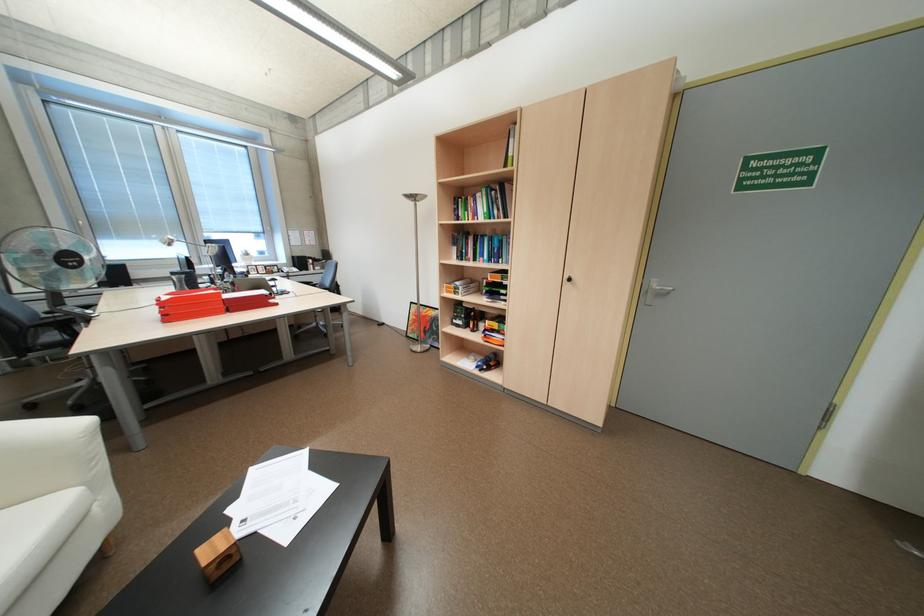
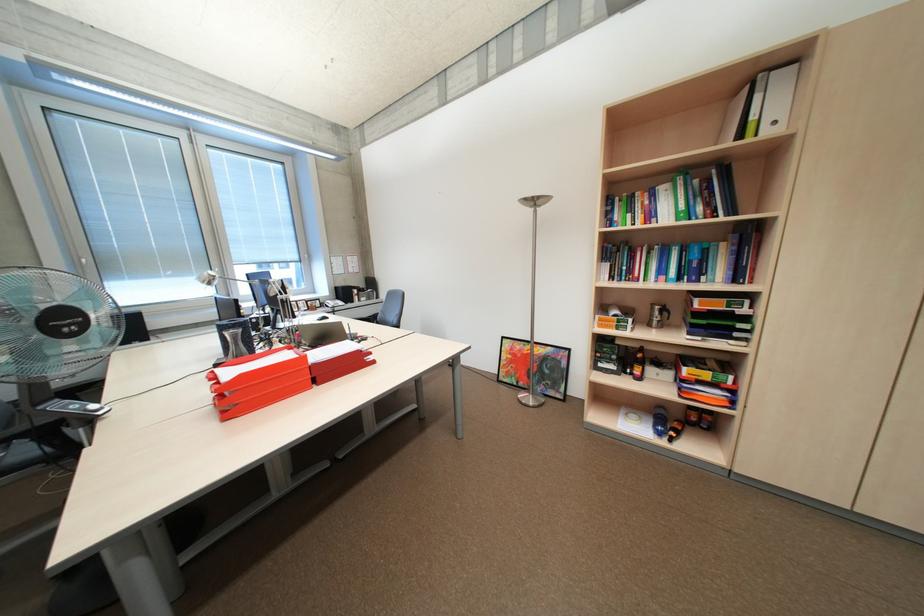
In the second image, find the point that corresponds to (521,140) in the first image.

(768, 97)